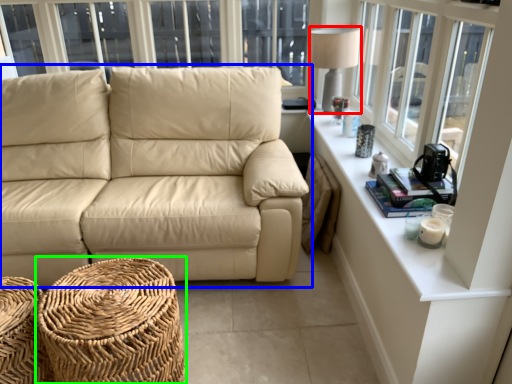
Question: Which is farther away from table lamp (highlighted by a red box)? studio couch (highlighted by a blue box) or footrest (highlighted by a green box)?

Choices:
 (A) studio couch
 (B) footrest

Answer: (B)